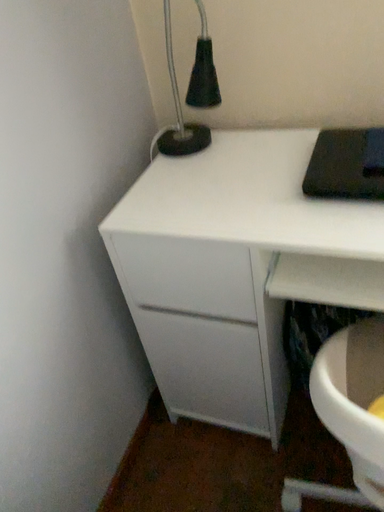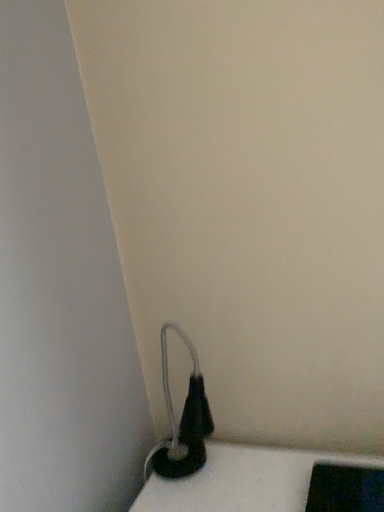
Question: Which way did the camera rotate in the video?

Choices:
 (A) rotated downward
 (B) rotated upward

Answer: (B)